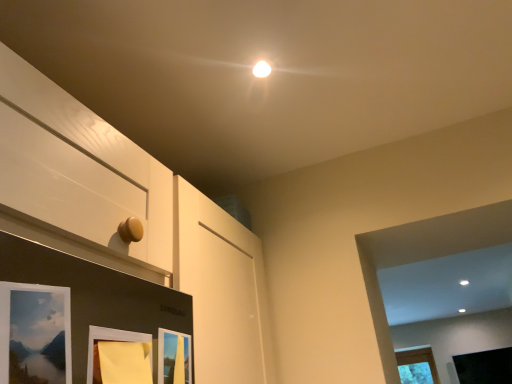
How much space does matte wooden picture frame at lower left, which ranks as the 4th picture frame in bottom-to-top order, occupy horizontally?

matte wooden picture frame at lower left, which ranks as the 4th picture frame in bottom-to-top order, is 2.31 inches in width.

In order to click on matte wooden picture frame at lower left, which is the first picture frame in left-to-right order in this screenshot , I will do `click(35, 333)`.

From a real-world perspective, is matte wooden picture frame at lower center, positioned as the 3th picture frame in front-to-back order, positioned above or below black matte picture frame at lower right, which is the fourth picture frame from top to bottom?

matte wooden picture frame at lower center, positioned as the 3th picture frame in front-to-back order, is situated lower than black matte picture frame at lower right, which is the fourth picture frame from top to bottom, in the real world.

Can you confirm if matte wooden picture frame at lower center, arranged as the 2th picture frame when ordered from the bottom, is shorter than black matte picture frame at lower right, which is the fourth picture frame from top to bottom?

Indeed, matte wooden picture frame at lower center, arranged as the 2th picture frame when ordered from the bottom, has a lesser height compared to black matte picture frame at lower right, which is the fourth picture frame from top to bottom.

Is there a large distance between matte wooden picture frame at lower center, the third picture frame viewed from the top, and black matte picture frame at lower right, which is the first picture frame in back-to-front order?

Yes, matte wooden picture frame at lower center, the third picture frame viewed from the top, and black matte picture frame at lower right, which is the first picture frame in back-to-front order, are located far from each other.

Between yellow paper at lower center, arranged as the second picture frame when viewed from the front, and black matte picture frame at lower right, which is counted as the 1th picture frame, starting from the right, which one has smaller width?

yellow paper at lower center, arranged as the second picture frame when viewed from the front.

Does yellow paper at lower center, which appears as the 2th picture frame when viewed from the top, have a lesser height compared to black matte picture frame at lower right, which is the fourth picture frame from top to bottom?

Correct, yellow paper at lower center, which appears as the 2th picture frame when viewed from the top, is not as tall as black matte picture frame at lower right, which is the fourth picture frame from top to bottom.

From the image's perspective, starting from the yellow paper at lower center, the third picture frame in the bottom-to-top sequence, which picture frame is the 2nd one below? Please provide its 2D coordinates.

[(485, 367)]

From a real-world perspective, who is located lower, yellow paper at lower center, arranged as the second picture frame when viewed from the front, or black matte picture frame at lower right, which is the fourth picture frame from top to bottom?

In real-world perspective, yellow paper at lower center, arranged as the second picture frame when viewed from the front, is lower.

From their relative heights in the image, would you say black matte picture frame at lower right, which is the first picture frame in back-to-front order, is taller or shorter than matte wooden picture frame at lower center, arranged as the 2th picture frame when ordered from the bottom?

black matte picture frame at lower right, which is the first picture frame in back-to-front order, is taller than matte wooden picture frame at lower center, arranged as the 2th picture frame when ordered from the bottom.

Is black matte picture frame at lower right, arranged as the fourth picture frame when viewed from the front, looking in the opposite direction of matte wooden picture frame at lower center, the third picture frame viewed from the top?

black matte picture frame at lower right, arranged as the fourth picture frame when viewed from the front, does not have its back to matte wooden picture frame at lower center, the third picture frame viewed from the top.

Starting from the black matte picture frame at lower right, the 1th picture frame when ordered from bottom to top, which picture frame is the 1st one in front? Please provide its 2D coordinates.

[(174, 357)]

Is black matte picture frame at lower right, the 1th picture frame when ordered from bottom to top, in front of matte wooden picture frame at lower center, arranged as the 2th picture frame when ordered from the bottom?

No.

Are matte wooden picture frame at lower left, which is the first picture frame in left-to-right order, and matte wooden picture frame at lower center, which is the 2th picture frame in back-to-front order, making contact?

No, matte wooden picture frame at lower left, which is the first picture frame in left-to-right order, is not in contact with matte wooden picture frame at lower center, which is the 2th picture frame in back-to-front order.

Considering the positions of objects matte wooden picture frame at lower left, which appears as the first picture frame when viewed from the top, and matte wooden picture frame at lower center, the 3th picture frame when ordered from left to right, in the image provided, who is behind, matte wooden picture frame at lower left, which appears as the first picture frame when viewed from the top, or matte wooden picture frame at lower center, the 3th picture frame when ordered from left to right,?

matte wooden picture frame at lower center, the 3th picture frame when ordered from left to right, is further away from the camera.

Is matte wooden picture frame at lower left, acting as the fourth picture frame starting from the back, positioned beyond the bounds of matte wooden picture frame at lower center, the 3th picture frame when ordered from left to right?

Yes.

Can you confirm if matte wooden picture frame at lower center, the 3th picture frame when ordered from left to right, is thinner than yellow paper at lower center, the third picture frame in the bottom-to-top sequence?

Yes, matte wooden picture frame at lower center, the 3th picture frame when ordered from left to right, is thinner than yellow paper at lower center, the third picture frame in the bottom-to-top sequence.

From the image's perspective, which one is positioned higher, matte wooden picture frame at lower center, which is the 2th picture frame in back-to-front order, or yellow paper at lower center, positioned as the 2th picture frame in left-to-right order?

From the image's view, yellow paper at lower center, positioned as the 2th picture frame in left-to-right order, is above.

Is matte wooden picture frame at lower center, which is the 2th picture frame in back-to-front order, taller or shorter than yellow paper at lower center, which appears as the 2th picture frame when viewed from the top?

Clearly, matte wooden picture frame at lower center, which is the 2th picture frame in back-to-front order, is taller compared to yellow paper at lower center, which appears as the 2th picture frame when viewed from the top.

From the image's perspective, which picture frame is the 1st one above the matte wooden picture frame at lower center, which is the 2th picture frame in back-to-front order? Please provide its 2D coordinates.

[(119, 356)]

Is matte wooden picture frame at lower left, which appears as the first picture frame when viewed from the top, far from black matte picture frame at lower right, the fourth picture frame positioned from the left?

That's right, there is a large distance between matte wooden picture frame at lower left, which appears as the first picture frame when viewed from the top, and black matte picture frame at lower right, the fourth picture frame positioned from the left.

Does point (48, 286) come in front of point (509, 356)?

Yes.

Who is smaller, matte wooden picture frame at lower left, positioned as the fourth picture frame in right-to-left order, or black matte picture frame at lower right, the fourth picture frame positioned from the left?

matte wooden picture frame at lower left, positioned as the fourth picture frame in right-to-left order.

Does matte wooden picture frame at lower left, which ranks as the 4th picture frame in bottom-to-top order, contain black matte picture frame at lower right, which is counted as the 1th picture frame, starting from the right?

No.

From the image's perspective, who appears lower, matte wooden picture frame at lower center, arranged as the 2th picture frame when ordered from the bottom, or matte wooden picture frame at lower left, which ranks as the 4th picture frame in bottom-to-top order?

matte wooden picture frame at lower center, arranged as the 2th picture frame when ordered from the bottom.

From a real-world perspective, which is physically above, matte wooden picture frame at lower center, which is the second picture frame from right to left, or matte wooden picture frame at lower left, which ranks as the 4th picture frame in bottom-to-top order?

From a 3D spatial view, matte wooden picture frame at lower left, which ranks as the 4th picture frame in bottom-to-top order, is above.

Is matte wooden picture frame at lower center, positioned as the 3th picture frame in front-to-back order, looking in the opposite direction of matte wooden picture frame at lower left, which ranks as the 4th picture frame in bottom-to-top order?

matte wooden picture frame at lower center, positioned as the 3th picture frame in front-to-back order, is not turned away from matte wooden picture frame at lower left, which ranks as the 4th picture frame in bottom-to-top order.

Starting from the black matte picture frame at lower right, the fourth picture frame positioned from the left, which picture frame is the 1st one in front? Please provide its 2D coordinates.

[(174, 357)]

This screenshot has width=512, height=384. Identify the location of the 2nd picture frame behind when counting from the yellow paper at lower center, arranged as the 3th picture frame when viewed from the back. (485, 367).

Estimate the real-world distances between objects in this image. Which object is further from matte wooden picture frame at lower center, which is the 2th picture frame in back-to-front order, yellow paper at lower center, arranged as the second picture frame when viewed from the front, or black matte picture frame at lower right, arranged as the fourth picture frame when viewed from the front?

black matte picture frame at lower right, arranged as the fourth picture frame when viewed from the front, is further to matte wooden picture frame at lower center, which is the 2th picture frame in back-to-front order.

From the image, which object appears to be nearer to black matte picture frame at lower right, which is counted as the 1th picture frame, starting from the right, yellow paper at lower center, positioned as the 2th picture frame in left-to-right order, or matte wooden picture frame at lower center, the 3th picture frame when ordered from left to right?

Among the two, matte wooden picture frame at lower center, the 3th picture frame when ordered from left to right, is located nearer to black matte picture frame at lower right, which is counted as the 1th picture frame, starting from the right.

From the image, which object appears to be nearer to matte wooden picture frame at lower left, which ranks as the 4th picture frame in bottom-to-top order, matte wooden picture frame at lower center, positioned as the 3th picture frame in front-to-back order, or yellow paper at lower center, arranged as the second picture frame when viewed from the front?

yellow paper at lower center, arranged as the second picture frame when viewed from the front, is closer to matte wooden picture frame at lower left, which ranks as the 4th picture frame in bottom-to-top order.

From the image, which object appears to be nearer to yellow paper at lower center, which appears as the 2th picture frame when viewed from the top, matte wooden picture frame at lower center, positioned as the 3th picture frame in front-to-back order, or matte wooden picture frame at lower left, which appears as the first picture frame when viewed from the top?

matte wooden picture frame at lower center, positioned as the 3th picture frame in front-to-back order, is closer to yellow paper at lower center, which appears as the 2th picture frame when viewed from the top.

Looking at the image, which one is located closer to matte wooden picture frame at lower left, the first picture frame when ordered from front to back, black matte picture frame at lower right, the fourth picture frame positioned from the left, or matte wooden picture frame at lower center, which is the 2th picture frame in back-to-front order?

matte wooden picture frame at lower center, which is the 2th picture frame in back-to-front order, lies closer to matte wooden picture frame at lower left, the first picture frame when ordered from front to back, than the other object.

From the image, which object appears to be nearer to black matte picture frame at lower right, the 1th picture frame when ordered from bottom to top, matte wooden picture frame at lower left, the first picture frame when ordered from front to back, or yellow paper at lower center, the 3th picture frame in the right-to-left sequence?

Based on the image, yellow paper at lower center, the 3th picture frame in the right-to-left sequence, appears to be nearer to black matte picture frame at lower right, the 1th picture frame when ordered from bottom to top.

Looking at this image, which object lies further to the anchor point yellow paper at lower center, arranged as the 3th picture frame when viewed from the back, black matte picture frame at lower right, the 1th picture frame when ordered from bottom to top, or matte wooden picture frame at lower left, which is the first picture frame in left-to-right order?

black matte picture frame at lower right, the 1th picture frame when ordered from bottom to top.

From the picture: From the image, which object appears to be nearer to black matte picture frame at lower right, which is the fourth picture frame from top to bottom, matte wooden picture frame at lower left, positioned as the fourth picture frame in right-to-left order, or matte wooden picture frame at lower center, the 3th picture frame when ordered from left to right?

Among the two, matte wooden picture frame at lower center, the 3th picture frame when ordered from left to right, is located nearer to black matte picture frame at lower right, which is the fourth picture frame from top to bottom.

Find the location of a particular element. picture frame between yellow paper at lower center, positioned as the 2th picture frame in left-to-right order, and black matte picture frame at lower right, which is the first picture frame in back-to-front order, along the z-axis is located at coordinates [x=174, y=357].

This screenshot has width=512, height=384. In order to click on picture frame located between matte wooden picture frame at lower left, which ranks as the 4th picture frame in bottom-to-top order, and matte wooden picture frame at lower center, arranged as the 2th picture frame when ordered from the bottom, in the depth direction in this screenshot , I will do `click(119, 356)`.